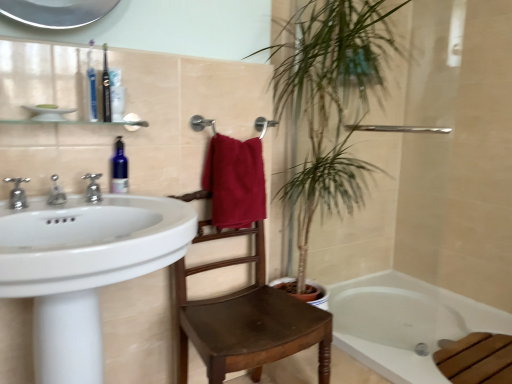
This screenshot has height=384, width=512. I want to click on green leafy plant at upper center, so click(329, 103).

This screenshot has height=384, width=512. What do you see at coordinates (83, 268) in the screenshot? I see `white glossy sink at left` at bounding box center [83, 268].

Locate an element on the screen. This screenshot has width=512, height=384. green leafy plant at upper center is located at coordinates (329, 103).

From the image's perspective, which one is positioned lower, blue plastic toothbrush at upper left, the 1th toiletry from the front, or dark brown wooden chair at center?

dark brown wooden chair at center, from the image's perspective.

Locate an element on the screen. the 1st toiletry behind the dark brown wooden chair at center is located at coordinates (91, 86).

Considering the relative sizes of blue plastic toothbrush at upper left, acting as the 2th toiletry starting from the back, and dark brown wooden chair at center in the image provided, is blue plastic toothbrush at upper left, acting as the 2th toiletry starting from the back, taller than dark brown wooden chair at center?

In fact, blue plastic toothbrush at upper left, acting as the 2th toiletry starting from the back, may be shorter than dark brown wooden chair at center.

Considering the points (93, 75) and (227, 322), which point is in front, point (93, 75) or point (227, 322)?

The point (93, 75) is closer.

Which object is closer to the camera taking this photo, translucent plastic toothbrush at upper left, placed as the first toiletry when sorted from back to front, or white glossy bathtub at lower right?

translucent plastic toothbrush at upper left, placed as the first toiletry when sorted from back to front.

Which of these two, translucent plastic toothbrush at upper left, which is counted as the second toiletry, starting from the front, or white glossy bathtub at lower right, stands shorter?

With less height is white glossy bathtub at lower right.

Is white glossy bathtub at lower right at the back of translucent plastic toothbrush at upper left, placed as the first toiletry when sorted from back to front?

That's not correct — translucent plastic toothbrush at upper left, placed as the first toiletry when sorted from back to front, is not looking away from white glossy bathtub at lower right.

Which is correct: translucent plastic toothbrush at upper left, which is counted as the second toiletry, starting from the front, is inside white glossy bathtub at lower right, or outside of it?

translucent plastic toothbrush at upper left, which is counted as the second toiletry, starting from the front, is spatially situated outside white glossy bathtub at lower right.

From the image's perspective, would you say white glossy sink at left is shown under translucent plastic toothbrush at upper left, placed as the first toiletry when sorted from back to front?

Indeed, from the image's perspective, white glossy sink at left is shown beneath translucent plastic toothbrush at upper left, placed as the first toiletry when sorted from back to front.

Does white glossy sink at left appear on the right side of translucent plastic toothbrush at upper left, which is counted as the second toiletry, starting from the front?

Incorrect, white glossy sink at left is not on the right side of translucent plastic toothbrush at upper left, which is counted as the second toiletry, starting from the front.

What's the angular difference between white glossy sink at left and translucent plastic toothbrush at upper left, placed as the first toiletry when sorted from back to front,'s facing directions?

0.114 degrees.

From a real-world perspective, who is located higher, white glossy sink at left or translucent plastic toothbrush at upper left, which is counted as the second toiletry, starting from the front?

In real-world perspective, translucent plastic toothbrush at upper left, which is counted as the second toiletry, starting from the front, is above.

Is dark brown wooden chair at center located within polished chrome faucet at left, acting as the first tap starting from the right?

No, dark brown wooden chair at center is not a part of polished chrome faucet at left, acting as the first tap starting from the right.

Which point is more forward, (97,175) or (209,299)?

The point (97,175) is closer.

Which is more to the right, polished chrome faucet at left, acting as the first tap starting from the right, or dark brown wooden chair at center?

dark brown wooden chair at center is more to the right.

From the image's perspective, is polished chrome faucet at left, acting as the first tap starting from the right, located beneath dark brown wooden chair at center?

No.

From a real-world perspective, which object rests below the other?

green leafy plant at upper center.

Choose the correct answer: Is green leafy plant at upper center inside silver metallic faucet at left, the 2th tap in the right-to-left sequence, or outside it?

green leafy plant at upper center is located beyond the bounds of silver metallic faucet at left, the 2th tap in the right-to-left sequence.

Considering the sizes of objects green leafy plant at upper center and silver metallic faucet at left, the 2th tap in the right-to-left sequence, in the image provided, who is thinner, green leafy plant at upper center or silver metallic faucet at left, the 2th tap in the right-to-left sequence,?

Thinner between the two is silver metallic faucet at left, the 2th tap in the right-to-left sequence.

Considering the relative sizes of green leafy plant at upper center and silver metallic faucet at left, marked as the second tap in a left-to-right arrangement, in the image provided, is green leafy plant at upper center shorter than silver metallic faucet at left, marked as the second tap in a left-to-right arrangement,?

Incorrect, the height of green leafy plant at upper center does not fall short of that of silver metallic faucet at left, marked as the second tap in a left-to-right arrangement.

Which is behind, point (263, 336) or point (237, 203)?

The point (237, 203) is farther.

From a real-world perspective, is dark brown wooden chair at center located higher than red cotton towel at center?

No, from a real-world perspective, dark brown wooden chair at center is not over red cotton towel at center

Considering the sizes of objects dark brown wooden chair at center and red cotton towel at center in the image provided, who is taller, dark brown wooden chair at center or red cotton towel at center?

dark brown wooden chair at center is taller.

Considering the sizes of objects dark brown wooden chair at center and red cotton towel at center in the image provided, who is smaller, dark brown wooden chair at center or red cotton towel at center?

red cotton towel at center.

Is red cotton towel at center positioned with its back to polished chrome faucet at left, acting as the first tap starting from the right?

No, polished chrome faucet at left, acting as the first tap starting from the right, is not at the back of red cotton towel at center.

Does point (228, 151) lie in front of point (94, 181)?

No, it is not.

In the image, is red cotton towel at center on the left side or the right side of polished chrome faucet at left, acting as the first tap starting from the right?

From the image, it's evident that red cotton towel at center is to the right of polished chrome faucet at left, acting as the first tap starting from the right.

Looking at this image, considering the relative sizes of red cotton towel at center and polished chrome faucet at left, arranged as the third tap when viewed from the left, in the image provided, is red cotton towel at center smaller than polished chrome faucet at left, arranged as the third tap when viewed from the left,?

Incorrect, red cotton towel at center is not smaller in size than polished chrome faucet at left, arranged as the third tap when viewed from the left.

From the dark brown wooden chair at center, count the 2nd toiletry to the left and point to it. Please provide its 2D coordinates.

[(91, 86)]

There is a white glossy bathtub at lower right. Find the location of `the 1st toiletry above it (from a real-world perspective)`. the 1st toiletry above it (from a real-world perspective) is located at coordinates (116, 95).

Considering their positions, is blue glass soap dispenser at upper left positioned further to dark brown wooden chair at center than white glossy sink at left?

blue glass soap dispenser at upper left lies further to dark brown wooden chair at center than the other object.

Looking at this image, from the image, which object appears to be nearer to white glossy bathtub at lower right, polished chrome faucet at left, arranged as the third tap when viewed from the left, or dark brown wooden chair at center?

Based on the image, dark brown wooden chair at center appears to be nearer to white glossy bathtub at lower right.

Which object lies further to the anchor point blue glass soap dispenser at upper left, white glossy sink at left or red cotton towel at center?

red cotton towel at center is further to blue glass soap dispenser at upper left.

Estimate the real-world distances between objects in this image. Which object is closer to satin nickel faucet at left, the third tap when ordered from right to left, blue glass soap dispenser at upper left or polished chrome faucet at left, arranged as the third tap when viewed from the left?

Among the two, polished chrome faucet at left, arranged as the third tap when viewed from the left, is located nearer to satin nickel faucet at left, the third tap when ordered from right to left.

Looking at the image, which one is located closer to blue glass soap dispenser at upper left, satin nickel faucet at left, arranged as the first tap when viewed from the left, or polished chrome faucet at left, arranged as the third tap when viewed from the left?

polished chrome faucet at left, arranged as the third tap when viewed from the left, is closer to blue glass soap dispenser at upper left.

When comparing their distances from blue glass soap dispenser at upper left, does polished chrome faucet at left, arranged as the third tap when viewed from the left, or white glossy bathtub at lower right seem further?

white glossy bathtub at lower right lies further to blue glass soap dispenser at upper left than the other object.

Looking at the image, which one is located closer to white glossy sink at left, green leafy plant at upper center or dark brown wooden chair at center?

dark brown wooden chair at center is closer to white glossy sink at left.

When comparing their distances from green leafy plant at upper center, does blue glass soap dispenser at upper left or satin nickel faucet at left, arranged as the first tap when viewed from the left, seem further?

satin nickel faucet at left, arranged as the first tap when viewed from the left, is further to green leafy plant at upper center.

Where is `toiletry between blue plastic toothbrush at upper left, the 1th toiletry from the front, and white glossy sink at left in the up-down direction`? The image size is (512, 384). toiletry between blue plastic toothbrush at upper left, the 1th toiletry from the front, and white glossy sink at left in the up-down direction is located at coordinates (116, 95).

Where is `soap dispenser located between blue plastic toothbrush at upper left, acting as the 2th toiletry starting from the back, and green leafy plant at upper center in the left-right direction`? soap dispenser located between blue plastic toothbrush at upper left, acting as the 2th toiletry starting from the back, and green leafy plant at upper center in the left-right direction is located at coordinates (119, 169).

Where is `soap dispenser between blue plastic toothbrush at upper left, acting as the 2th toiletry starting from the back, and dark brown wooden chair at center, in the vertical direction`? Image resolution: width=512 pixels, height=384 pixels. soap dispenser between blue plastic toothbrush at upper left, acting as the 2th toiletry starting from the back, and dark brown wooden chair at center, in the vertical direction is located at coordinates (119, 169).

Where is `tap between translucent plastic toothbrush at upper left, placed as the first toiletry when sorted from back to front, and satin nickel faucet at left, the third tap when ordered from right to left, vertically`? tap between translucent plastic toothbrush at upper left, placed as the first toiletry when sorted from back to front, and satin nickel faucet at left, the third tap when ordered from right to left, vertically is located at coordinates (93, 188).